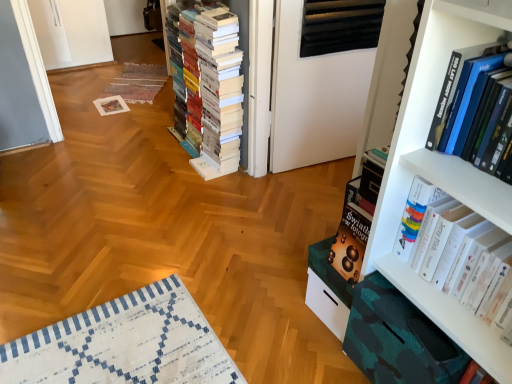
Where is `vacant space situated on the left part of white matte bookcase at right`? vacant space situated on the left part of white matte bookcase at right is located at coordinates (157, 249).